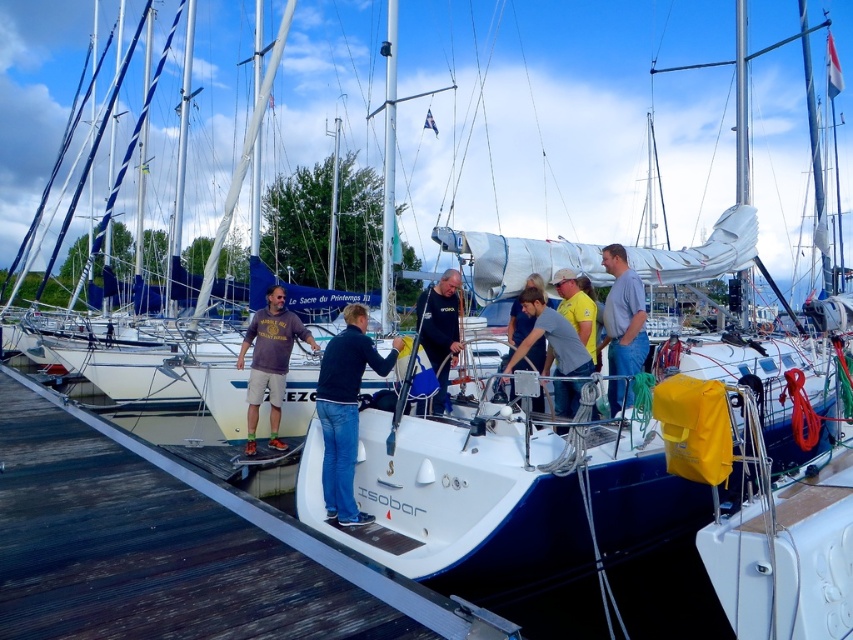
Between white wood dock at center and matte gray t-shirt at center, which one is positioned lower?

white wood dock at center

Can you confirm if white wood dock at center is bigger than matte gray t-shirt at center?

Correct, white wood dock at center is larger in size than matte gray t-shirt at center.

Does point (13, 378) lie behind point (277, 371)?

That is True.

At what (x,y) coordinates should I click in order to perform the action: click on white wood dock at center. Please return your answer as a coordinate pair (x, y). The height and width of the screenshot is (640, 853). Looking at the image, I should click on (300, 536).

Between point (608, 396) and point (563, 381), which one is positioned behind?

The point (563, 381) is behind.

Which of these two, light blue denim jeans at right or gray matte shirt at center, stands taller?

light blue denim jeans at right

Between point (631, 314) and point (561, 330), which one is positioned behind?

Positioned behind is point (631, 314).

What are the coordinates of `light blue denim jeans at right` in the screenshot? It's located at (624, 312).

Between point (354, 376) and point (386, 90), which one is positioned in front?

Point (354, 376) is more forward.

From the picture: Does blue jeans at center have a greater width compared to white glossy mast at center?

No, blue jeans at center is not wider than white glossy mast at center.

Does point (338, 362) come closer to viewer compared to point (389, 196)?

Yes, it is in front of point (389, 196).

Find the location of a particular element. The image size is (853, 640). blue jeans at center is located at coordinates (345, 410).